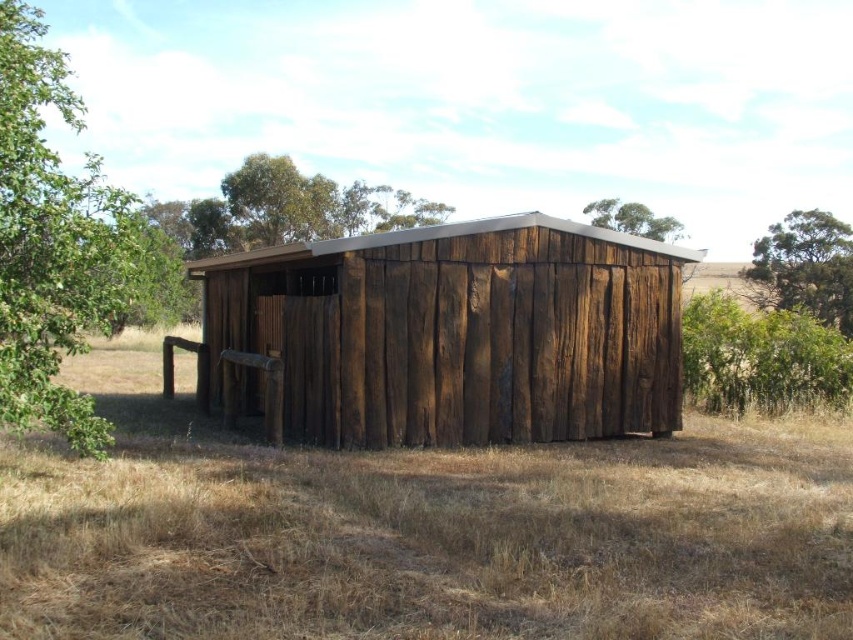
Question: Does brown dry grass at center appear on the left side of weathered wood barn at center?

Choices:
 (A) no
 (B) yes

Answer: (A)

Question: Which of the following is the closest to the observer?

Choices:
 (A) (80, 352)
 (B) (599, 225)

Answer: (A)

Question: Is weathered wood barn at center below green leafy tree at upper center?

Choices:
 (A) yes
 (B) no

Answer: (A)

Question: Among these objects, which one is nearest to the camera?

Choices:
 (A) green leafy tree at upper center
 (B) green leafy tree at left

Answer: (B)

Question: Does brown dry grass at center appear on the left side of weathered wood barn at center?

Choices:
 (A) yes
 (B) no

Answer: (B)

Question: Among these points, which one is farthest from the camera?

Choices:
 (A) (84, 445)
 (B) (596, 202)

Answer: (B)